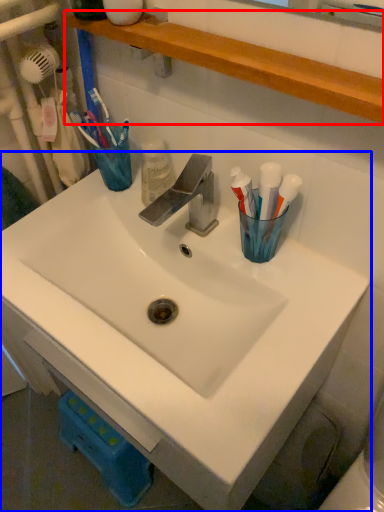
Question: Which point is further to the camera, shelve (highlighted by a red box) or sink (highlighted by a blue box)?

Choices:
 (A) shelve
 (B) sink

Answer: (B)